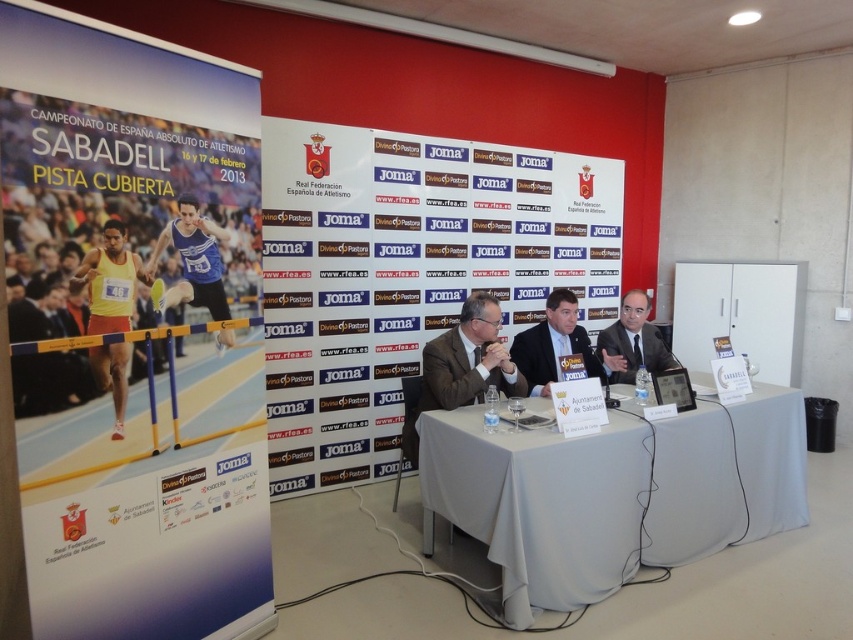
Question: From the image, what is the correct spatial relationship of white paperboard at center in relation to matte orange shorts at left?

Choices:
 (A) right
 (B) left

Answer: (A)

Question: Which point is farther to the camera?

Choices:
 (A) (450, 413)
 (B) (480, 355)
 (C) (99, 499)

Answer: (B)

Question: Is white cloth-covered table at center closer to the viewer compared to blue jersey at center?

Choices:
 (A) no
 (B) yes

Answer: (A)

Question: Which object is positioned farthest from the white cloth-covered table at center?

Choices:
 (A) dark blue suit at center
 (B) matte orange shorts at left
 (C) matte brown suit at center
 (D) blue jersey at center

Answer: (B)

Question: Does white paper at left have a larger size compared to matte black suit at center?

Choices:
 (A) no
 (B) yes

Answer: (B)

Question: Which is nearer to the matte orange shorts at left?

Choices:
 (A) matte brown suit at center
 (B) dark blue suit at center

Answer: (A)